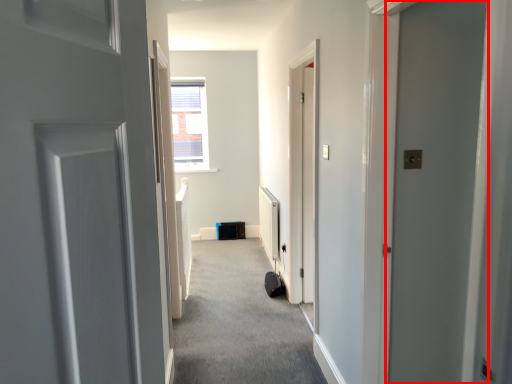
Question: From the image's perspective, where is door (annotated by the red box) located relative to corridor?

Choices:
 (A) below
 (B) above

Answer: (B)